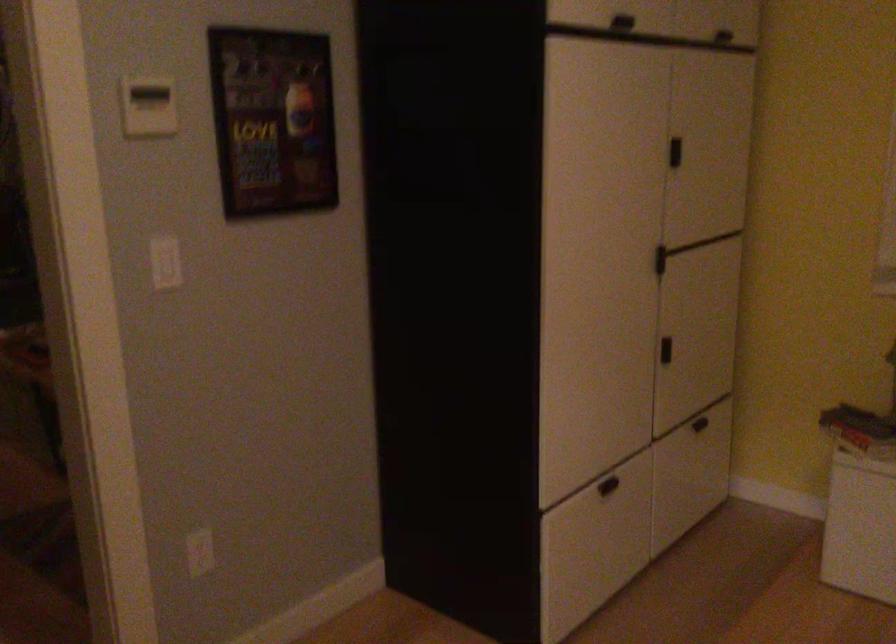
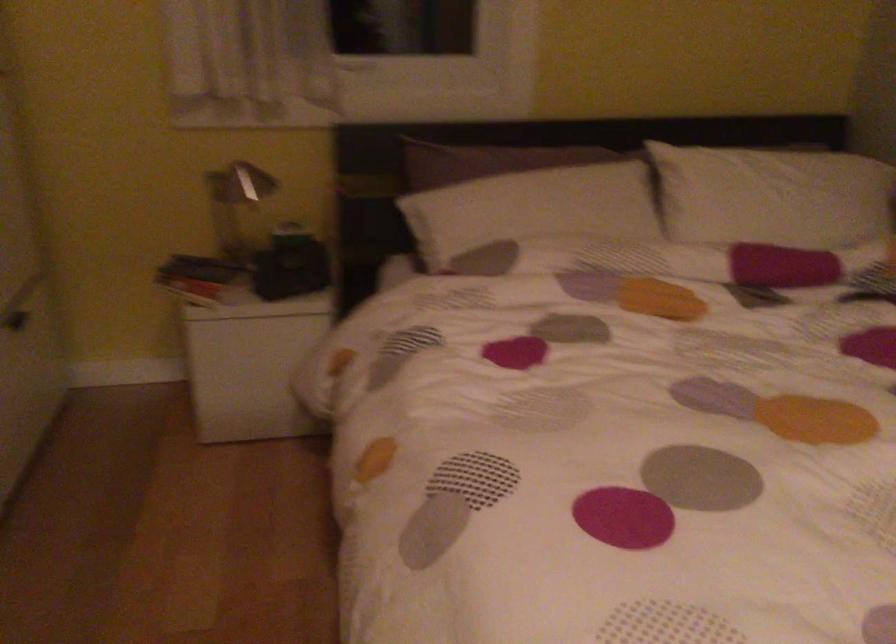
Locate, in the second image, the point that corresponds to the point at 699,426 in the first image.

(21, 323)